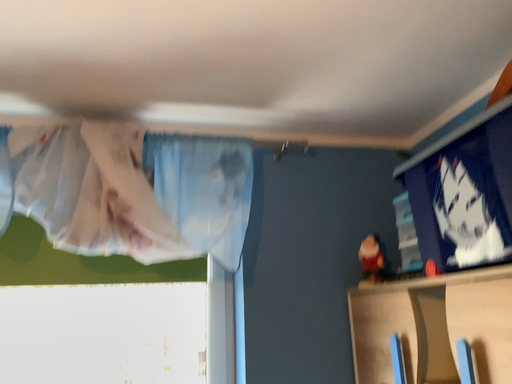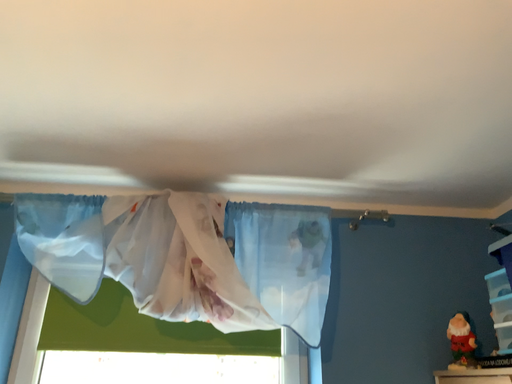
Question: Which way did the camera rotate in the video?

Choices:
 (A) rotated upward
 (B) rotated downward

Answer: (A)